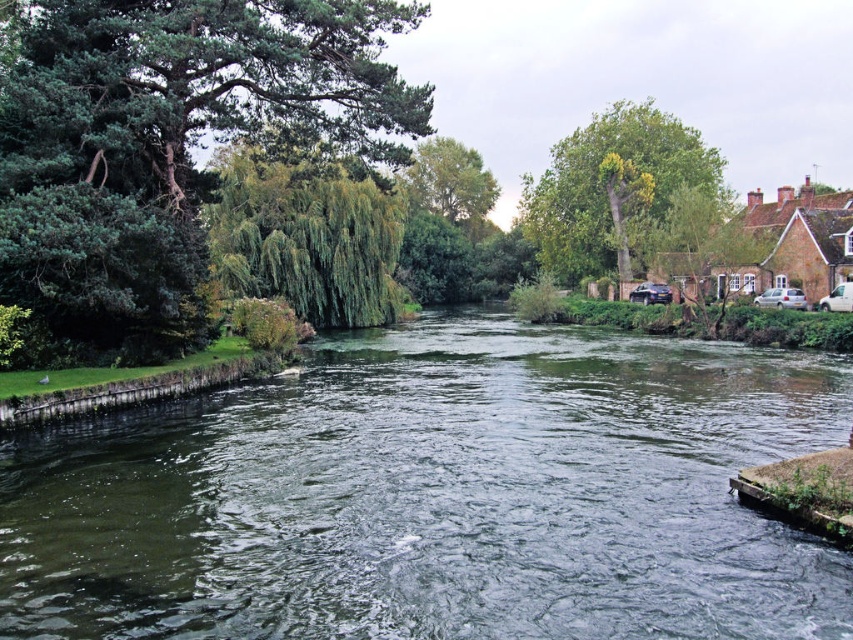
You are standing on the riverside path and see the green water at center and the green leafy tree at upper center. Which object is positioned higher in the image?

The green leafy tree at upper center is positioned higher in the image than the green water at center.